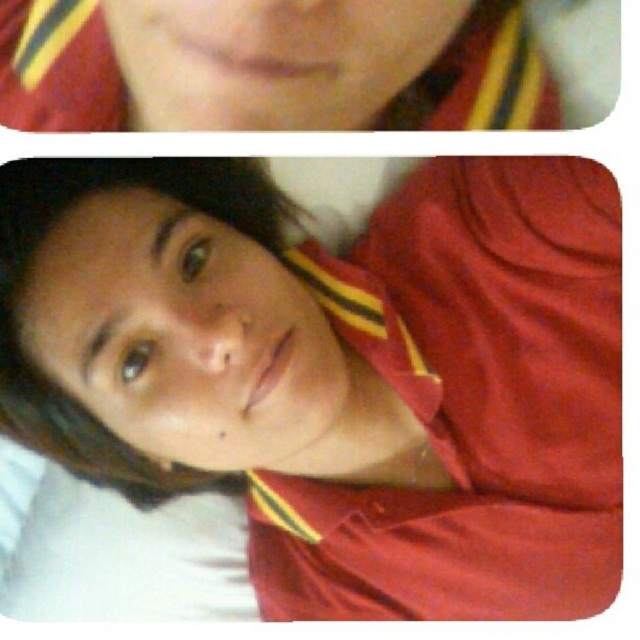
Question: Does matte red shirt at center have a lesser width compared to matte red shirt at upper center?

Choices:
 (A) no
 (B) yes

Answer: (A)

Question: Does matte red shirt at center have a smaller size compared to matte red shirt at upper center?

Choices:
 (A) yes
 (B) no

Answer: (B)

Question: Does matte red shirt at center appear over matte red shirt at upper center?

Choices:
 (A) no
 (B) yes

Answer: (A)

Question: Which of the following is the farthest from the observer?

Choices:
 (A) (458, 52)
 (B) (246, 406)

Answer: (A)

Question: Which object is closer to the camera taking this photo?

Choices:
 (A) matte red shirt at center
 (B) matte red shirt at upper center

Answer: (B)